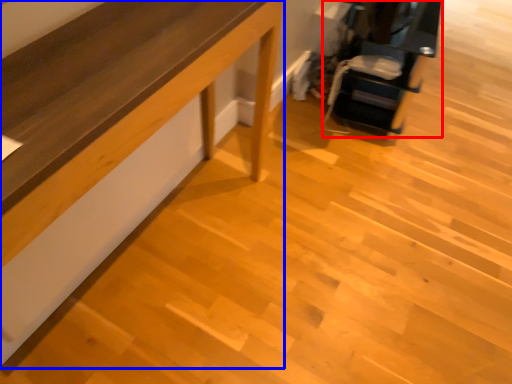
Question: Among these objects, which one is farthest to the camera, furniture (highlighted by a red box) or furniture (highlighted by a blue box)?

Choices:
 (A) furniture
 (B) furniture

Answer: (A)